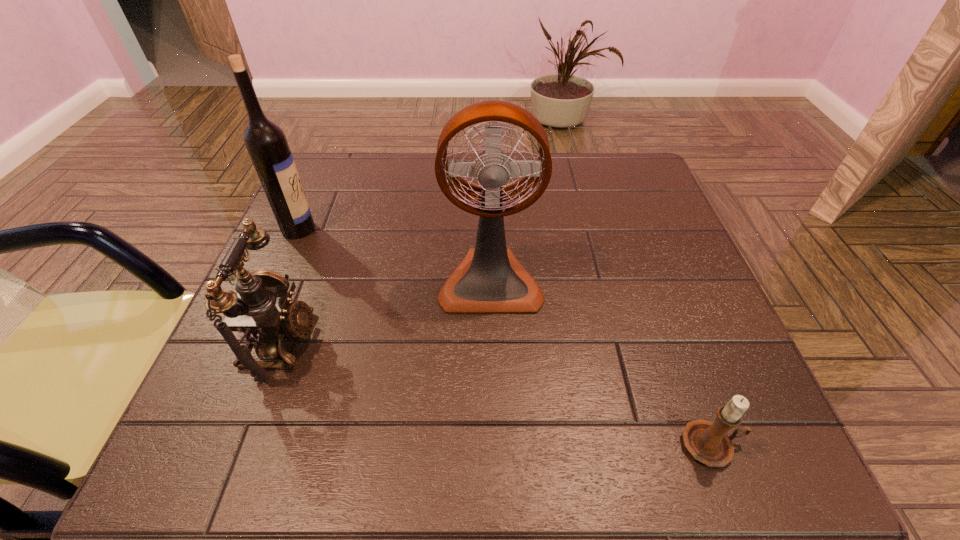
Where is `empty location between the second shortest object and the second object from right to left`? The height and width of the screenshot is (540, 960). empty location between the second shortest object and the second object from right to left is located at coordinates (386, 312).

In order to click on unoccupied position between the telephone and the rightmost object in this screenshot , I will do `click(496, 394)`.

Find the location of a particular element. This screenshot has height=540, width=960. blank region between the nearest object and the telephone is located at coordinates (496, 394).

What are the coordinates of `free space that is in between the wine bottle and the third object from left to right` in the screenshot? It's located at (395, 255).

Identify the location of vacant space in between the third tallest object and the shortest object. This screenshot has width=960, height=540. (496, 394).

Where is `free point between the third object from left to right and the rightmost object`? free point between the third object from left to right and the rightmost object is located at coordinates (601, 363).

Where is `empty location between the candle holder and the third tallest object`? The height and width of the screenshot is (540, 960). empty location between the candle holder and the third tallest object is located at coordinates (496, 394).

At what (x,y) coordinates should I click in order to perform the action: click on empty space that is in between the fan and the telephone. Please return your answer as a coordinate pair (x, y). This screenshot has height=540, width=960. Looking at the image, I should click on (386, 312).

Identify which object is the third closest to the wine bottle. Please provide its 2D coordinates. Your answer should be formatted as a tuple, i.e. [(x, y)], where the tuple contains the x and y coordinates of a point satisfying the conditions above.

[(708, 442)]

Where is `object that can be found as the closest to the third object from left to right`? This screenshot has width=960, height=540. object that can be found as the closest to the third object from left to right is located at coordinates (261, 310).